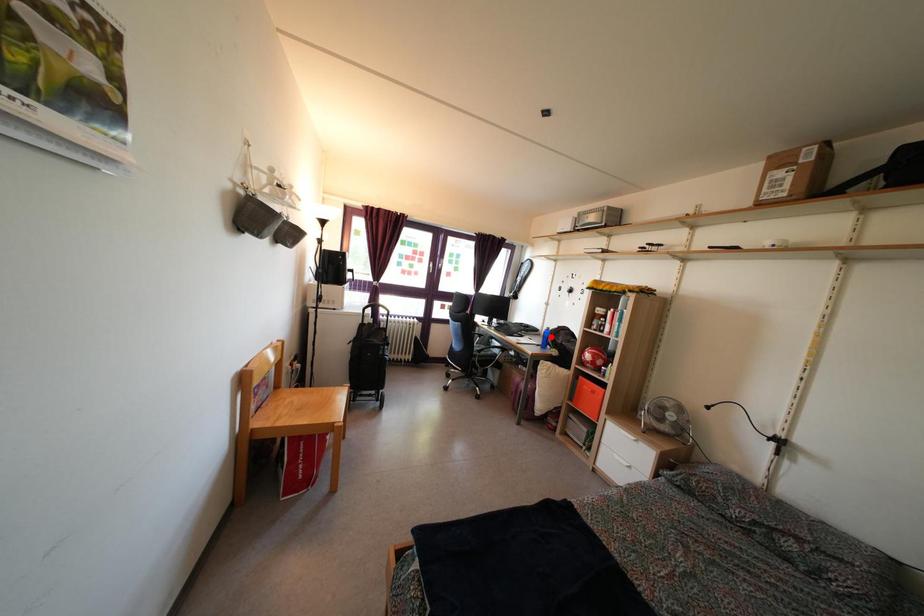
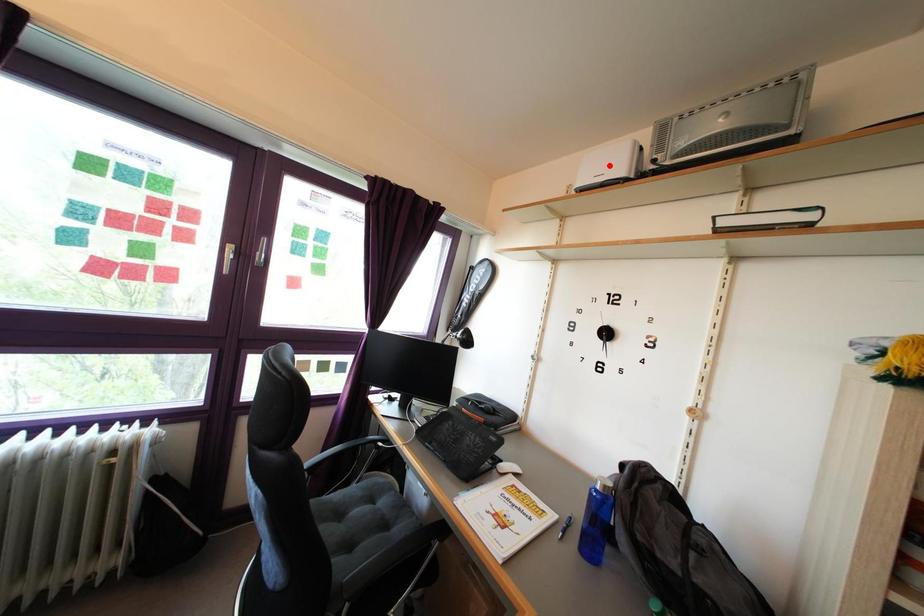
I am providing you with two images of the same scene from different viewpoints. A red point is marked on the first image and another point is marked on the second image. Is the marked point in image1 the same physical position as the marked point in image2?

No